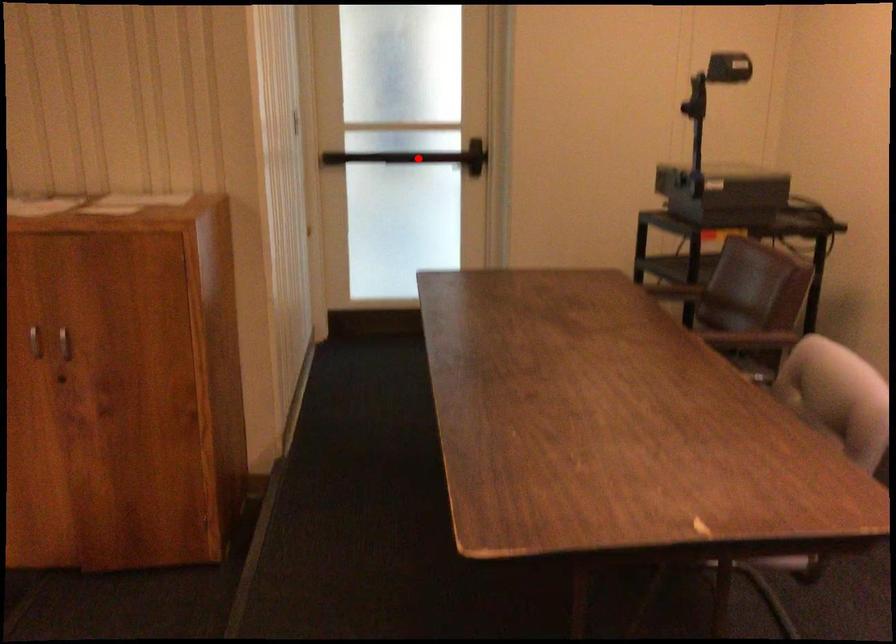
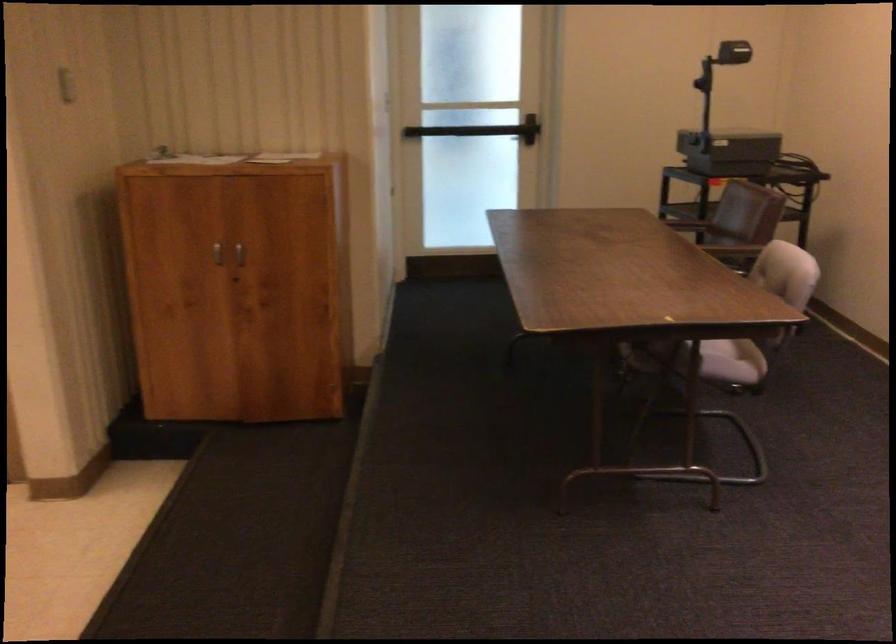
The point at the highlighted location is marked in the first image. Where is the corresponding point in the second image?

(479, 129)